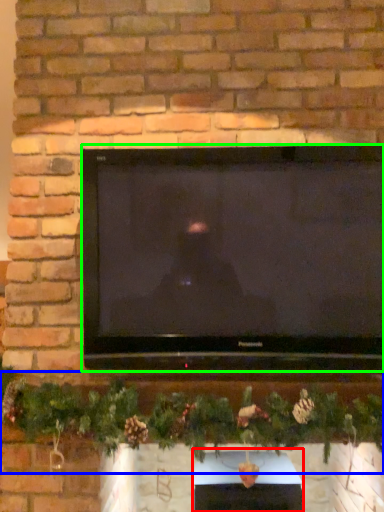
Question: Which object is the closest to the fireplace (highlighted by a red box)? Choose among these: christmas decoration (highlighted by a blue box) or television (highlighted by a green box).

Choices:
 (A) christmas decoration
 (B) television

Answer: (A)